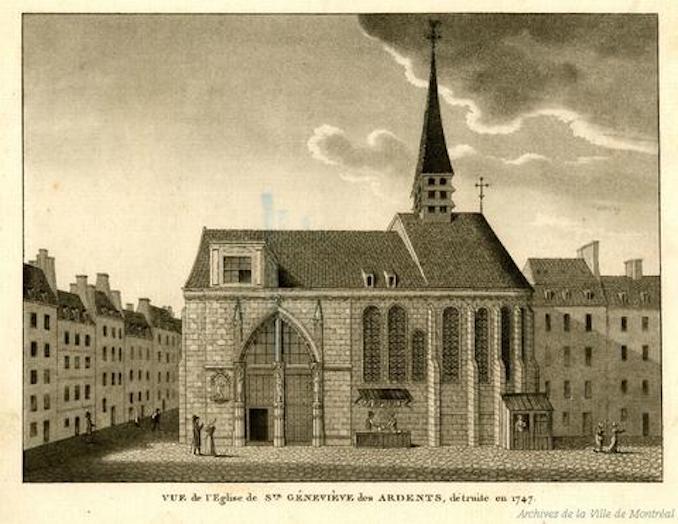
Where is `stand`? stand is located at coordinates 521,442.